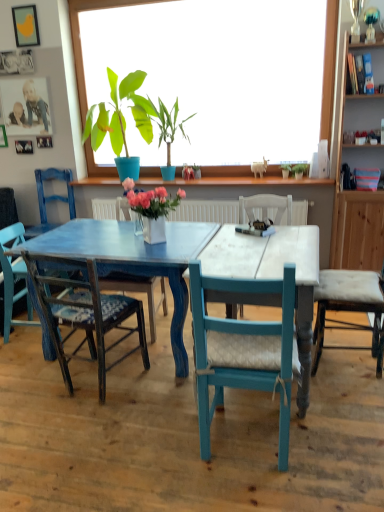
Question: Should I look upward or downward to see teal wood chair at center, the 2th chair positioned from the right?

Choices:
 (A) down
 (B) up

Answer: (A)

Question: Is green matte plant at upper center, acting as the 5th houseplant starting from the left, aimed at matte yellow bird at upper left, marked as the fifth picture frame in a bottom-to-top arrangement?

Choices:
 (A) no
 (B) yes

Answer: (A)

Question: Are green matte plant at upper center, the fourth houseplant positioned from the front, and matte yellow bird at upper left, which appears as the first picture frame when viewed from the top, located far from each other?

Choices:
 (A) yes
 (B) no

Answer: (A)

Question: Is green matte plant at upper center, the fourth houseplant positioned from the front, thinner than matte yellow bird at upper left, marked as the fifth picture frame in a bottom-to-top arrangement?

Choices:
 (A) yes
 (B) no

Answer: (B)

Question: From a real-world perspective, is green matte plant at upper center, which ranks as the 2th houseplant in back-to-front order, over matte yellow bird at upper left, which appears as the first picture frame when viewed from the top?

Choices:
 (A) no
 (B) yes

Answer: (A)

Question: Considering the relative positions of green matte plant at upper center, which ranks as the 2th houseplant in back-to-front order, and matte yellow bird at upper left, which appears as the first picture frame when viewed from the top, in the image provided, is green matte plant at upper center, which ranks as the 2th houseplant in back-to-front order, in front of matte yellow bird at upper left, which appears as the first picture frame when viewed from the top,?

Choices:
 (A) no
 (B) yes

Answer: (B)

Question: Is green matte plant at upper center, which ranks as the 2th houseplant in back-to-front order, located outside matte yellow bird at upper left, marked as the fifth picture frame in a bottom-to-top arrangement?

Choices:
 (A) yes
 (B) no

Answer: (A)

Question: Would you consider brushed metal picture frame at upper left, the first picture frame ordered from the bottom, to be distant from white ceramic vase at center, the 3th houseplant when ordered from right to left?

Choices:
 (A) yes
 (B) no

Answer: (A)

Question: Is the depth of brushed metal picture frame at upper left, arranged as the fifth picture frame when viewed from the top, less than that of white ceramic vase at center, the 1th houseplant viewed from the front?

Choices:
 (A) no
 (B) yes

Answer: (A)

Question: From a real-world perspective, is brushed metal picture frame at upper left, the first picture frame ordered from the bottom, on white ceramic vase at center, the 3th houseplant when ordered from right to left?

Choices:
 (A) yes
 (B) no

Answer: (A)

Question: Is brushed metal picture frame at upper left, the first picture frame ordered from the bottom, not inside white ceramic vase at center, the 1th houseplant viewed from the front?

Choices:
 (A) yes
 (B) no

Answer: (A)

Question: Is brushed metal picture frame at upper left, arranged as the fifth picture frame when viewed from the top, bigger than white ceramic vase at center, the 1th houseplant viewed from the front?

Choices:
 (A) no
 (B) yes

Answer: (A)

Question: Could you tell me if brushed metal picture frame at upper left, the first picture frame ordered from the bottom, is facing white ceramic vase at center, positioned as the third houseplant in left-to-right order?

Choices:
 (A) no
 (B) yes

Answer: (A)

Question: Does white ceramic vase at center, the fifth houseplant in the back-to-front sequence, have a greater height compared to matte blue chair at center, arranged as the fourth chair when viewed from the left?

Choices:
 (A) no
 (B) yes

Answer: (A)